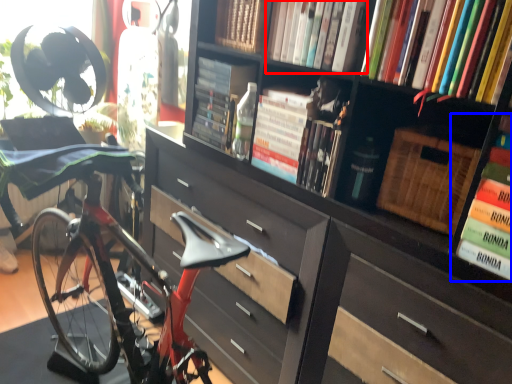
Question: Which point is closer to the camera, book (highlighted by a red box) or book (highlighted by a blue box)?

Choices:
 (A) book
 (B) book

Answer: (B)